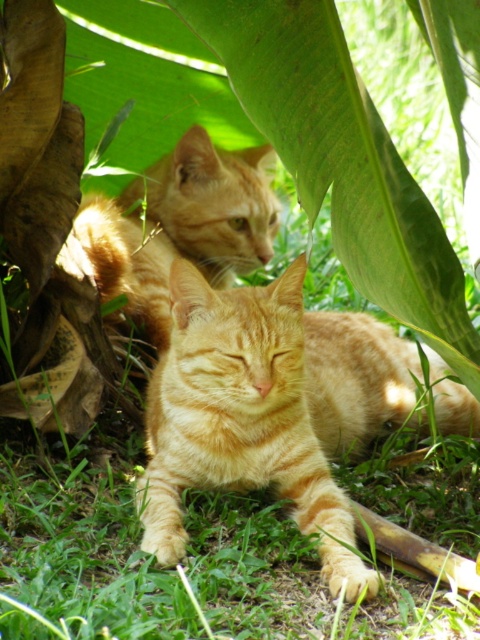
Between green leafy at upper center and orange tabby cat at upper center, which one has less height?

orange tabby cat at upper center

Does green leafy at upper center come behind orange tabby cat at upper center?

No, it is in front of orange tabby cat at upper center.

Is point (398, 234) more distant than point (202, 132)?

No, (398, 234) is closer to viewer.

The height and width of the screenshot is (640, 480). I want to click on green leafy at upper center, so click(343, 161).

Who is more distant from viewer, (x=317, y=524) or (x=213, y=228)?

The point (x=213, y=228) is behind.

This screenshot has width=480, height=640. Identify the location of orange fur cat at center. (268, 410).

Locate an element on the screen. The width and height of the screenshot is (480, 640). orange fur cat at center is located at coordinates (268, 410).

Is orange fur cat at center shorter than green leafy at upper center?

In fact, orange fur cat at center may be taller than green leafy at upper center.

Which is more to the right, orange fur cat at center or green leafy at upper center?

Positioned to the right is orange fur cat at center.

This screenshot has height=640, width=480. In order to click on orange fur cat at center in this screenshot , I will do `click(268, 410)`.